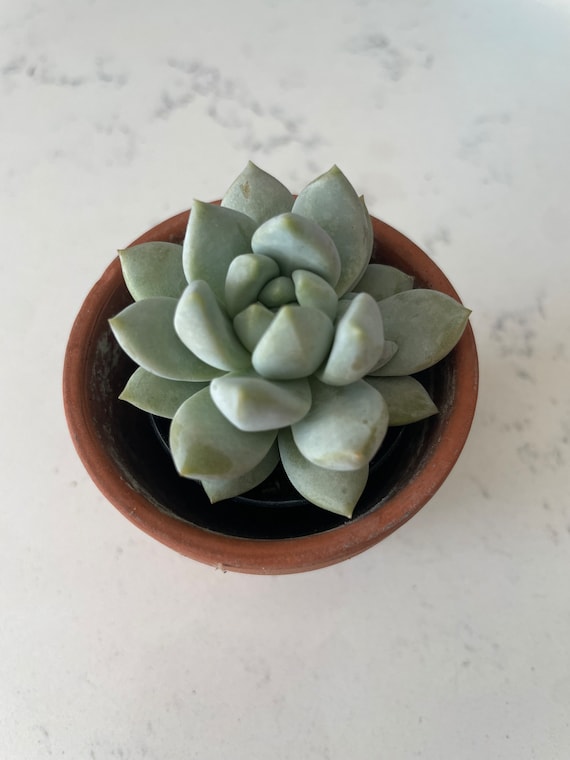
Where is `green plastic plant pot`? This screenshot has height=760, width=570. green plastic plant pot is located at coordinates (275, 505).